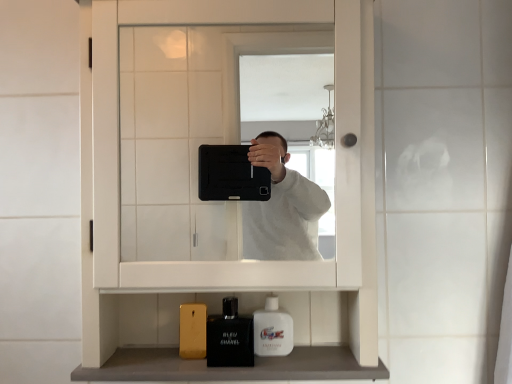
The width and height of the screenshot is (512, 384). In order to click on matte black perfume at lower center in this screenshot , I will do `click(230, 337)`.

Identify the location of smooth gray countertop at lower center. This screenshot has height=384, width=512. (231, 367).

Where is `white matte medicine cabinet at center`? The image size is (512, 384). white matte medicine cabinet at center is located at coordinates (215, 203).

I want to click on white glossy mouthwash at lower center, so pyautogui.click(x=272, y=329).

Consider the image. Is white glossy mouthwash at lower center facing away from smooth gray countertop at lower center?

No, smooth gray countertop at lower center is not at the back of white glossy mouthwash at lower center.

Is white glossy mouthwash at lower center to the right of smooth gray countertop at lower center from the viewer's perspective?

Yes, white glossy mouthwash at lower center is to the right of smooth gray countertop at lower center.

You are a GUI agent. You are given a task and a screenshot of the screen. Output one action in this format:
    pyautogui.click(x=<x>, y=<y>)
    Task: Click on the counter top that appears below the white glossy mouthwash at lower center (from a real-world perspective)
    
    Given the screenshot: What is the action you would take?
    [231, 367]

Which of these two, white glossy mouthwash at lower center or smooth gray countertop at lower center, is bigger?

With larger size is smooth gray countertop at lower center.

What's the angular difference between smooth gray countertop at lower center and white matte medicine cabinet at center's facing directions?

0.00123 degrees.

Could you tell me if smooth gray countertop at lower center is turned towards white matte medicine cabinet at center?

No, smooth gray countertop at lower center is not facing towards white matte medicine cabinet at center.

Find the location of a particular element. The image size is (512, 384). counter top below the white matte medicine cabinet at center (from the image's perspective) is located at coordinates (231, 367).

Between smooth gray countertop at lower center and white matte medicine cabinet at center, which one has smaller width?

smooth gray countertop at lower center.

From a real-world perspective, is white glossy mouthwash at lower center under white matte medicine cabinet at center?

Yes, from a real-world perspective, white glossy mouthwash at lower center is under white matte medicine cabinet at center.

Can you confirm if white glossy mouthwash at lower center is smaller than white matte medicine cabinet at center?

Correct, white glossy mouthwash at lower center occupies less space than white matte medicine cabinet at center.

Is point (277, 335) closer to viewer compared to point (208, 75)?

Yes, it is.

Where is `counter top on the right of white matte medicine cabinet at center`? This screenshot has height=384, width=512. counter top on the right of white matte medicine cabinet at center is located at coordinates (231, 367).

How far apart are white matte medicine cabinet at center and smooth gray countertop at lower center?

white matte medicine cabinet at center is 35.16 inches from smooth gray countertop at lower center.

Consider the image. Would you say white matte medicine cabinet at center is inside or outside smooth gray countertop at lower center?

white matte medicine cabinet at center is outside smooth gray countertop at lower center.

From a real-world perspective, which is physically below, white matte medicine cabinet at center or smooth gray countertop at lower center?

From a 3D spatial view, smooth gray countertop at lower center is below.

Does matte black perfume at lower center lie in front of white glossy mouthwash at lower center?

Yes, it is in front of white glossy mouthwash at lower center.

Considering the positions of point (215, 360) and point (267, 331), is point (215, 360) closer or farther from the camera than point (267, 331)?

Point (215, 360) is positioned farther from the camera compared to point (267, 331).

Is matte black perfume at lower center oriented towards white glossy mouthwash at lower center?

No, matte black perfume at lower center is not oriented towards white glossy mouthwash at lower center.

Identify the location of mouthwash that appears on the right of matte black perfume at lower center. (272, 329).

Is white matte medicine cabinet at center not close to matte black perfume at lower center?

No, white matte medicine cabinet at center is not far away from matte black perfume at lower center.

Looking at this image, from a real-world perspective, is white matte medicine cabinet at center physically located above or below matte black perfume at lower center?

From a real-world perspective, white matte medicine cabinet at center is physically above matte black perfume at lower center.

Is white matte medicine cabinet at center facing towards matte black perfume at lower center?

Yes, white matte medicine cabinet at center is turned towards matte black perfume at lower center.

Which of these two, white matte medicine cabinet at center or matte black perfume at lower center, is bigger?

white matte medicine cabinet at center is bigger.

Which point is more distant from viewer, (164,177) or (258,316)?

The point (164,177) is farther.

Considering the sizes of white matte medicine cabinet at center and white glossy mouthwash at lower center in the image, is white matte medicine cabinet at center bigger or smaller than white glossy mouthwash at lower center?

Clearly, white matte medicine cabinet at center is larger in size than white glossy mouthwash at lower center.

Does white matte medicine cabinet at center come in front of white glossy mouthwash at lower center?

Yes, white matte medicine cabinet at center is closer to the viewer.

From the image's perspective, which is below, white matte medicine cabinet at center or white glossy mouthwash at lower center?

white glossy mouthwash at lower center.

The image size is (512, 384). In the image, there is a smooth gray countertop at lower center. In order to click on mouthwash above it (from the image's perspective) in this screenshot , I will do `click(272, 329)`.

The width and height of the screenshot is (512, 384). I want to click on counter top on the right side of white matte medicine cabinet at center, so click(231, 367).

From the image, which object appears to be nearer to white matte medicine cabinet at center, matte black perfume at lower center or white glossy mouthwash at lower center?

matte black perfume at lower center.

When comparing their distances from smooth gray countertop at lower center, does matte black perfume at lower center or white matte medicine cabinet at center seem further?

white matte medicine cabinet at center lies further to smooth gray countertop at lower center than the other object.

Considering their positions, is white matte medicine cabinet at center positioned further to matte black perfume at lower center than white glossy mouthwash at lower center?

white matte medicine cabinet at center.

Based on their spatial positions, is white glossy mouthwash at lower center or matte black perfume at lower center closer to smooth gray countertop at lower center?

matte black perfume at lower center is positioned closer to the anchor smooth gray countertop at lower center.

Looking at the image, which one is located closer to matte black perfume at lower center, white matte medicine cabinet at center or smooth gray countertop at lower center?

Among the two, smooth gray countertop at lower center is located nearer to matte black perfume at lower center.

Which object lies further to the anchor point white glossy mouthwash at lower center, white matte medicine cabinet at center or matte black perfume at lower center?

Among the two, white matte medicine cabinet at center is located further to white glossy mouthwash at lower center.

Looking at this image, from the image, which object appears to be nearer to matte black perfume at lower center, white glossy mouthwash at lower center or white matte medicine cabinet at center?

white glossy mouthwash at lower center.

Considering their positions, is matte black perfume at lower center positioned further to white glossy mouthwash at lower center than smooth gray countertop at lower center?

smooth gray countertop at lower center is positioned further to the anchor white glossy mouthwash at lower center.

Locate an element on the screen. toiletry between white matte medicine cabinet at center and smooth gray countertop at lower center in the up-down direction is located at coordinates (230, 337).

At what (x,y) coordinates should I click in order to perform the action: click on mouthwash between white matte medicine cabinet at center and matte black perfume at lower center in the up-down direction. Please return your answer as a coordinate pair (x, y). Image resolution: width=512 pixels, height=384 pixels. Looking at the image, I should click on (272, 329).

Image resolution: width=512 pixels, height=384 pixels. Find the location of `counter top between matte black perfume at lower center and white glossy mouthwash at lower center in the horizontal direction`. counter top between matte black perfume at lower center and white glossy mouthwash at lower center in the horizontal direction is located at coordinates (231, 367).

Where is `mouthwash that lies between white matte medicine cabinet at center and smooth gray countertop at lower center from top to bottom`? The height and width of the screenshot is (384, 512). mouthwash that lies between white matte medicine cabinet at center and smooth gray countertop at lower center from top to bottom is located at coordinates (272, 329).